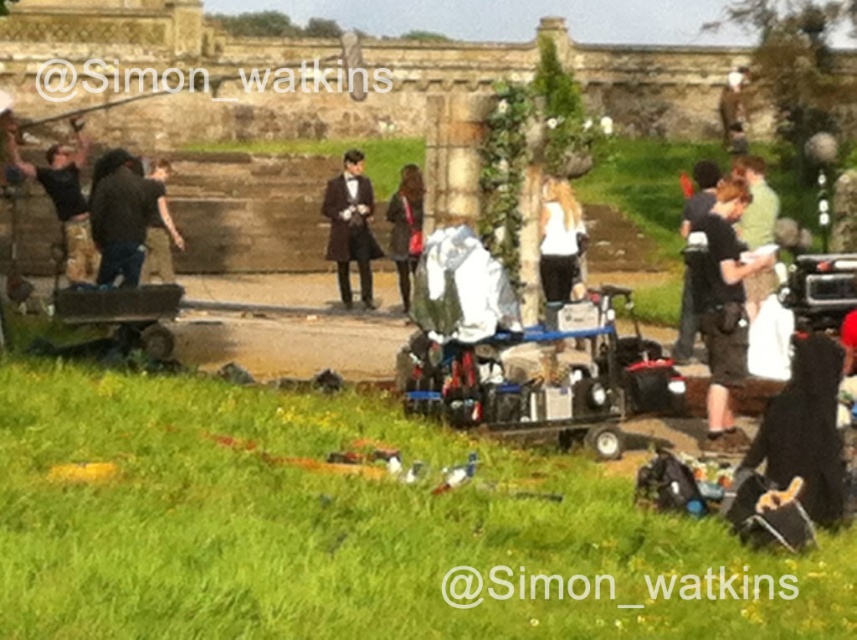
You are an actor on the film set shown in the scene. You need to quickly access the dark gray fabric jacket at center to check its fit before a scene. However, there is a person wearing camouflage pants at left blocking your path. Can you walk directly to the jacket without moving around the person?

The dark gray fabric jacket at center is behind the camouflage pants at left, so you would need to go around the person wearing camouflage pants at left to reach the jacket since it is blocking your direct path.

What is located at the coordinates point (124,216) in the image?

The point (124,216) indicates dark gray fabric at center.